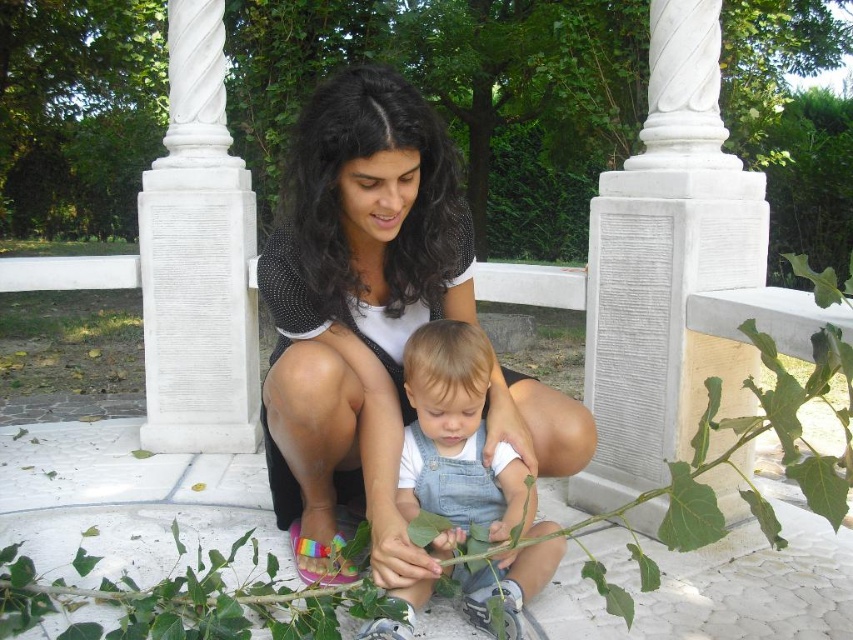
You are a photographer trying to capture a photo of the black mesh top at center and the denim overalls at center. Which object should you zoom in on to ensure both are in focus without moving the camera?

You should zoom in on the black mesh top at center because it is wider than the denim overalls at center, so focusing on it will help both objects stay in focus.

In the scene shown: You are standing in the outdoor scene and want to hand an item to the woman wearing the black mesh top at center. Since she is taller than the child in denim overalls at center, where should you aim to place the item so she can easily reach it?

The black mesh top at center is above denim overalls at center, so you should aim to place the item above the denim overalls at center to ensure the woman can easily reach it.